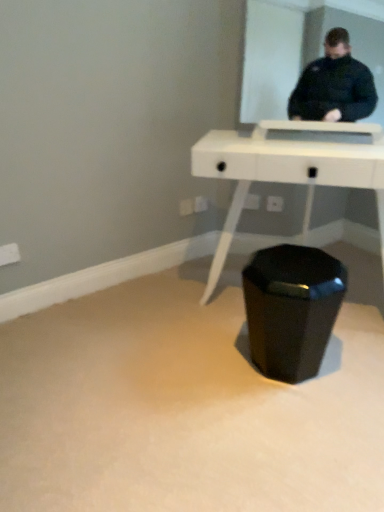
Question: Is black glossy waste container at center not near white glossy table at center?

Choices:
 (A) yes
 (B) no

Answer: (B)

Question: From the image's perspective, does black glossy waste container at center appear lower than white glossy table at center?

Choices:
 (A) no
 (B) yes

Answer: (B)

Question: Considering the relative positions of black glossy waste container at center and white glossy table at center in the image provided, is black glossy waste container at center to the right of white glossy table at center from the viewer's perspective?

Choices:
 (A) no
 (B) yes

Answer: (A)

Question: Is black glossy waste container at center touching white glossy table at center?

Choices:
 (A) no
 (B) yes

Answer: (A)

Question: Can you confirm if black glossy waste container at center is wider than white glossy table at center?

Choices:
 (A) no
 (B) yes

Answer: (A)

Question: Is black glossy waste container at center facing away from white glossy table at center?

Choices:
 (A) yes
 (B) no

Answer: (B)

Question: From a real-world perspective, does white glossy table at center stand above black glossy waste container at center?

Choices:
 (A) yes
 (B) no

Answer: (A)

Question: Could you tell me if white glossy table at center is turned towards black glossy waste container at center?

Choices:
 (A) no
 (B) yes

Answer: (B)

Question: Is white glossy table at center positioned before black glossy waste container at center?

Choices:
 (A) no
 (B) yes

Answer: (B)

Question: Is white glossy table at center not close to black glossy waste container at center?

Choices:
 (A) yes
 (B) no

Answer: (B)

Question: Can you see white glossy table at center touching black glossy waste container at center?

Choices:
 (A) yes
 (B) no

Answer: (B)

Question: Is white glossy table at center oriented away from black glossy waste container at center?

Choices:
 (A) no
 (B) yes

Answer: (A)

Question: Would you say black glossy waste container at center is to the left or to the right of white glossy table at center in the picture?

Choices:
 (A) left
 (B) right

Answer: (A)